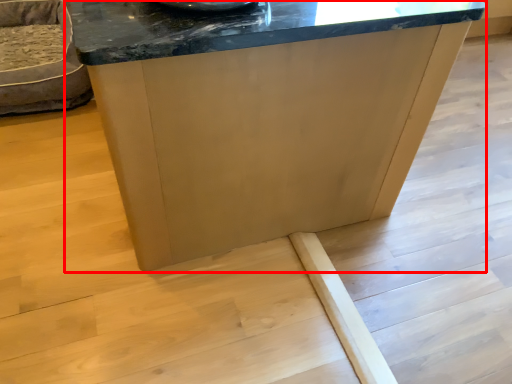
Question: From the image's perspective, what is the correct spatial positioning of table (annotated by the red box) in reference to furniture?

Choices:
 (A) below
 (B) above

Answer: (A)